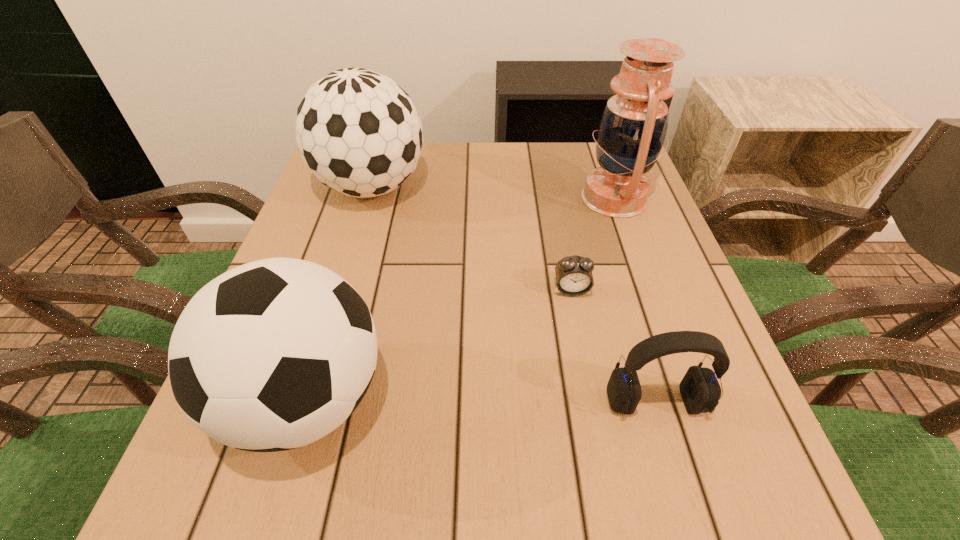
Find the location of a particular element. the tallest object is located at coordinates coord(632,130).

Where is `the farther soccer ball`? This screenshot has height=540, width=960. the farther soccer ball is located at coordinates (358, 131).

What are the coordinates of `the nearer soccer ball` in the screenshot? It's located at (272, 355).

Where is `the second shortest object`? the second shortest object is located at coordinates (700, 390).

Where is `alarm clock`? This screenshot has height=540, width=960. alarm clock is located at coordinates (574, 277).

The width and height of the screenshot is (960, 540). What are the coordinates of `the third farthest object` in the screenshot? It's located at (574, 277).

At what (x,y) coordinates should I click in order to perform the action: click on free point located 0.110m on the front of the tallest object. Please return your answer as a coordinate pair (x, y). The image size is (960, 540). Looking at the image, I should click on (636, 261).

The height and width of the screenshot is (540, 960). What are the coordinates of `vacant region located on the right of the farther soccer ball` in the screenshot? It's located at (496, 187).

I want to click on vacant space located 0.360m on the right of the nearer soccer ball, so click(620, 399).

The width and height of the screenshot is (960, 540). In order to click on free space located 0.110m on the headband of the second shortest object in this screenshot , I will do `click(685, 502)`.